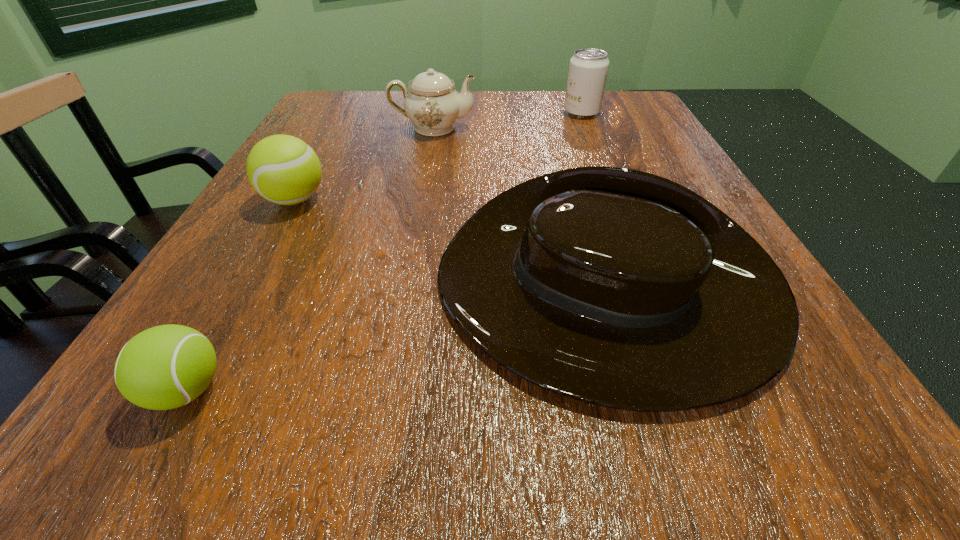
Where is `free space located 0.180m on the right of the nearer tennis ball`? free space located 0.180m on the right of the nearer tennis ball is located at coordinates (386, 390).

You are a GUI agent. You are given a task and a screenshot of the screen. Output one action in this format:
    pyautogui.click(x=<x>, y=<y>)
    Task: Click on the soda can located at the far edge
    This screenshot has width=960, height=540.
    Given the screenshot: What is the action you would take?
    pyautogui.click(x=588, y=68)

The width and height of the screenshot is (960, 540). I want to click on chinaware located at the far edge, so click(x=433, y=105).

Identify the location of cowboy hat that is positioned at the near edge. The image size is (960, 540). [x=616, y=287].

Find the location of a particular element. This screenshot has height=540, width=960. tennis ball that is at the near edge is located at coordinates (164, 367).

You are a GUI agent. You are given a task and a screenshot of the screen. Output one action in this format:
    pyautogui.click(x=<x>, y=<y>)
    Task: Click on the soda can that is at the right edge
    The height and width of the screenshot is (540, 960).
    Given the screenshot: What is the action you would take?
    pyautogui.click(x=588, y=68)

The height and width of the screenshot is (540, 960). Find the location of `cowboy hat that is at the right edge`. cowboy hat that is at the right edge is located at coordinates (616, 287).

This screenshot has height=540, width=960. Identify the location of object that is positioned at the near left corner. (164, 367).

Image resolution: width=960 pixels, height=540 pixels. I want to click on object situated at the far right corner, so click(588, 68).

The width and height of the screenshot is (960, 540). I want to click on object positioned at the near right corner, so click(x=616, y=287).